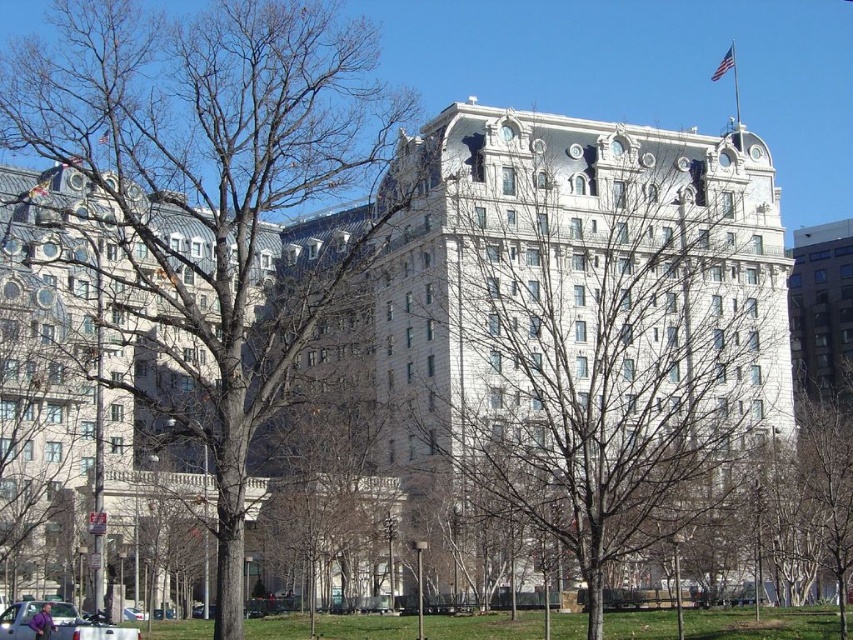
You are standing in front of the classical building and want to walk to the nearest tree. There are two trees in the scene labeled as bare branches at center and bare wood tree at center. Which one should you walk towards to reach the closest tree?

The bare branches at center is 51.65 feet away from the bare wood tree at center. Since you want to reach the closest tree, you should walk towards whichever of the two trees is nearest to your current position. However, without knowing your exact location relative to both trees, it is impossible to determine which one is closer to you.

You are an architect analyzing the trees in front of the classical building. Which of the two trees at the center has a thinner trunk, the bare branches at center or the bare wood tree at center?

The bare branches at center has a thinner trunk than the bare wood tree at center.

You are standing in front of the building and notice two elements in the foreground. Which of the two, the bare branches at center or the bare wood tree at center, is closer to you?

The bare branches at center is positioned under the bare wood tree at center, so the bare branches at center is closer to you.